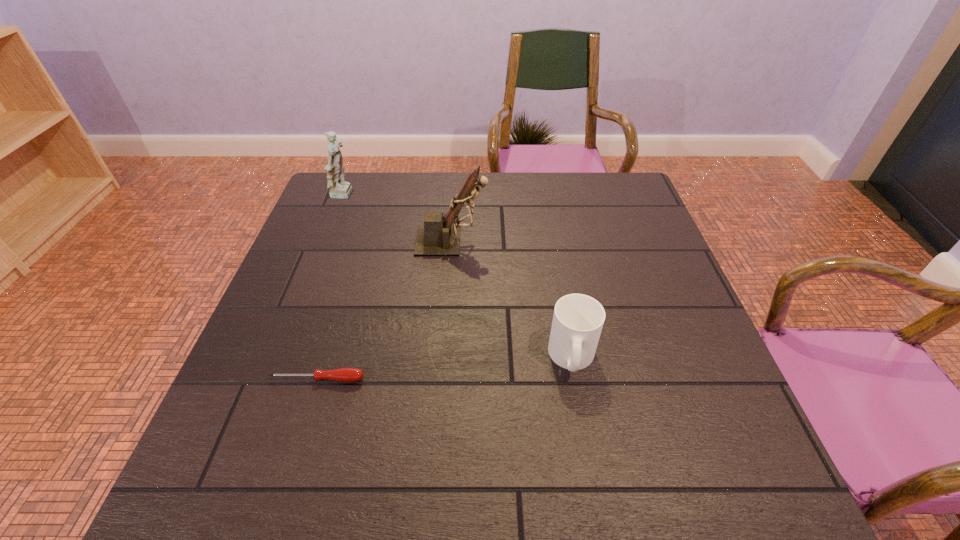
Identify the location of vacant region located on the right of the screwdriver. The height and width of the screenshot is (540, 960). (434, 379).

Find the location of a particular element. This screenshot has height=540, width=960. object at the far edge is located at coordinates (338, 188).

The height and width of the screenshot is (540, 960). In order to click on figurine positioned at the left edge in this screenshot , I will do `click(338, 188)`.

Locate an element on the screen. This screenshot has height=540, width=960. screwdriver that is at the left edge is located at coordinates (348, 375).

At what (x,y) coordinates should I click in order to perform the action: click on object that is at the far left corner. Please return your answer as a coordinate pair (x, y). This screenshot has height=540, width=960. Looking at the image, I should click on (338, 188).

Find the location of a particular element. The image size is (960, 540). free region at the near edge of the desktop is located at coordinates (380, 457).

Where is `vacant space at the left edge`? The image size is (960, 540). vacant space at the left edge is located at coordinates (304, 290).

At what (x,y) coordinates should I click in order to perform the action: click on free space at the right edge of the desktop. Please return your answer as a coordinate pair (x, y). The width and height of the screenshot is (960, 540). Looking at the image, I should click on (655, 406).

Where is `vacant space at the far left corner of the desktop`? vacant space at the far left corner of the desktop is located at coordinates (341, 206).

The height and width of the screenshot is (540, 960). Find the location of `vacant position at the near left corner of the desktop`. vacant position at the near left corner of the desktop is located at coordinates (199, 496).